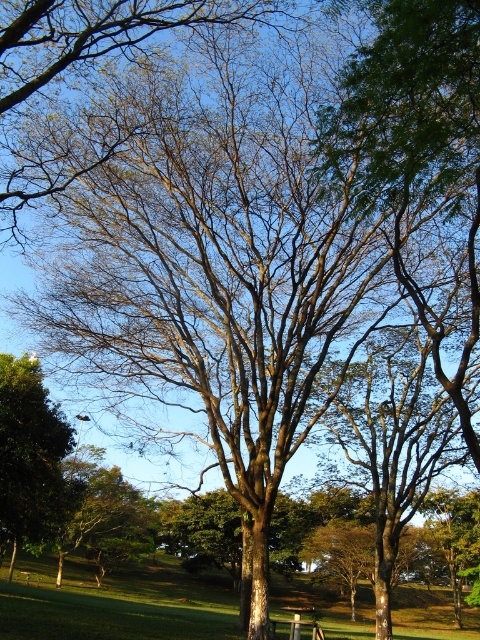
Image resolution: width=480 pixels, height=640 pixels. Describe the element at coordinates (117, 602) in the screenshot. I see `green grass at center` at that location.

Does green grass at center appear over green leafy tree at lower left?

Incorrect, green grass at center is not positioned above green leafy tree at lower left.

Measure the distance between point (22, 620) and camera.

Point (22, 620) and camera are 20.35 meters apart.

Identify the location of green grass at center. This screenshot has height=640, width=480. (117, 602).